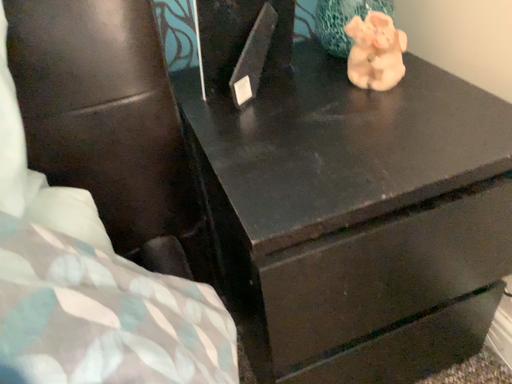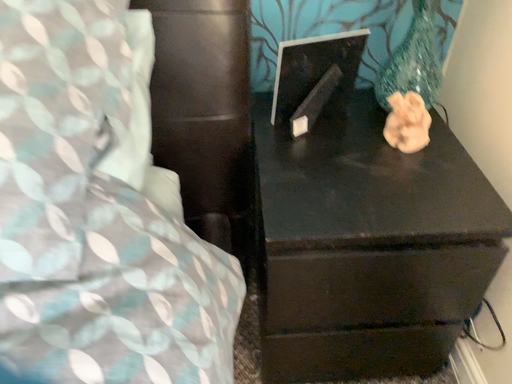
Question: Which way did the camera rotate in the video?

Choices:
 (A) rotated right
 (B) rotated left

Answer: (B)